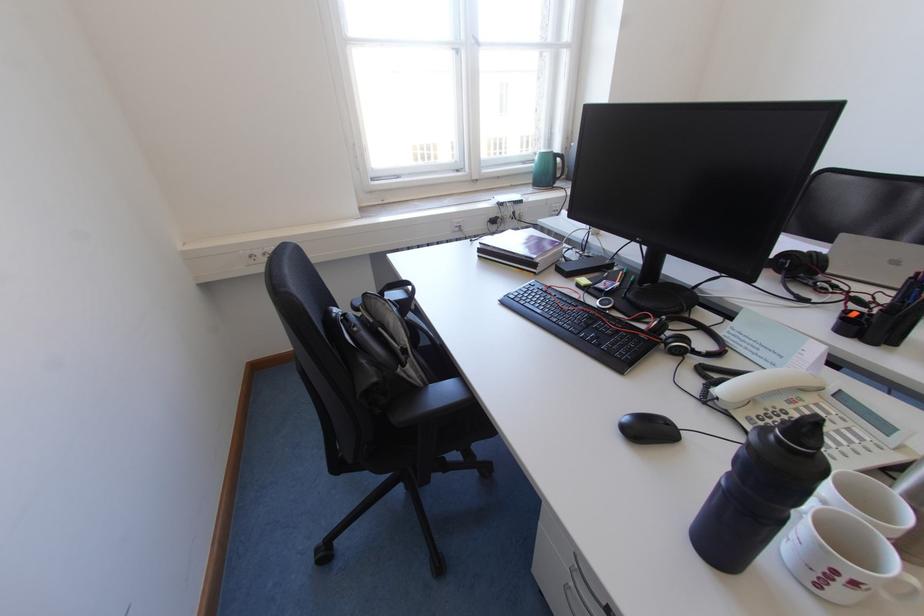
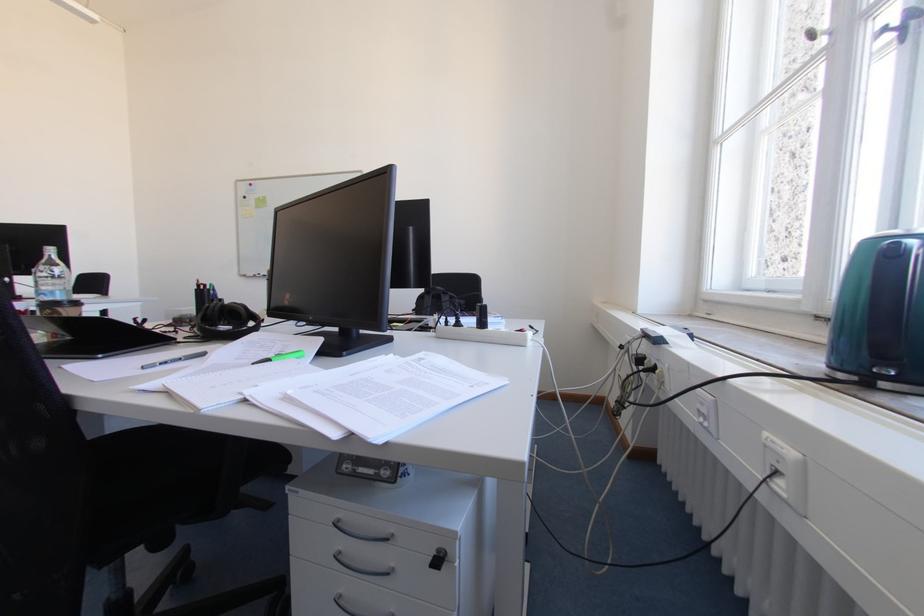
Question: I am providing you with two images of the same scene from different viewpoints. Please identify which objects are invisible in image2.

Choices:
 (A) silver drawer handle
 (B) green capped pen
 (C) white mug handle
 (D) blue box lid

Answer: (C)